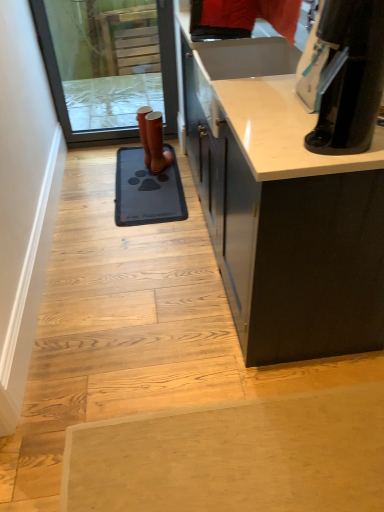
You are a GUI agent. You are given a task and a screenshot of the screen. Output one action in this format:
    pyautogui.click(x=<x>, y=<y>)
    Task: Click on the vacant space to the right of white smooth door at left
    This screenshot has height=512, width=384.
    Given the screenshot: What is the action you would take?
    point(170,276)